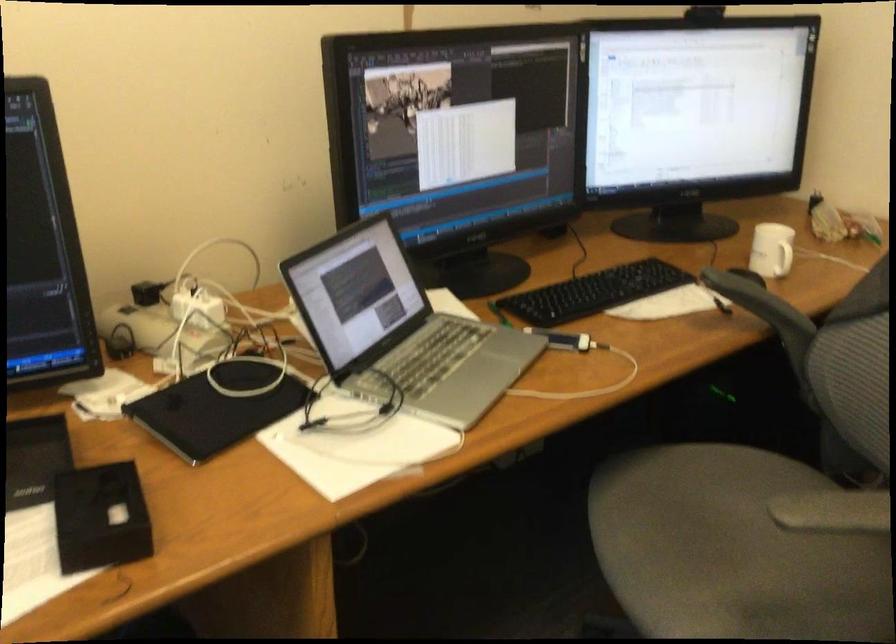
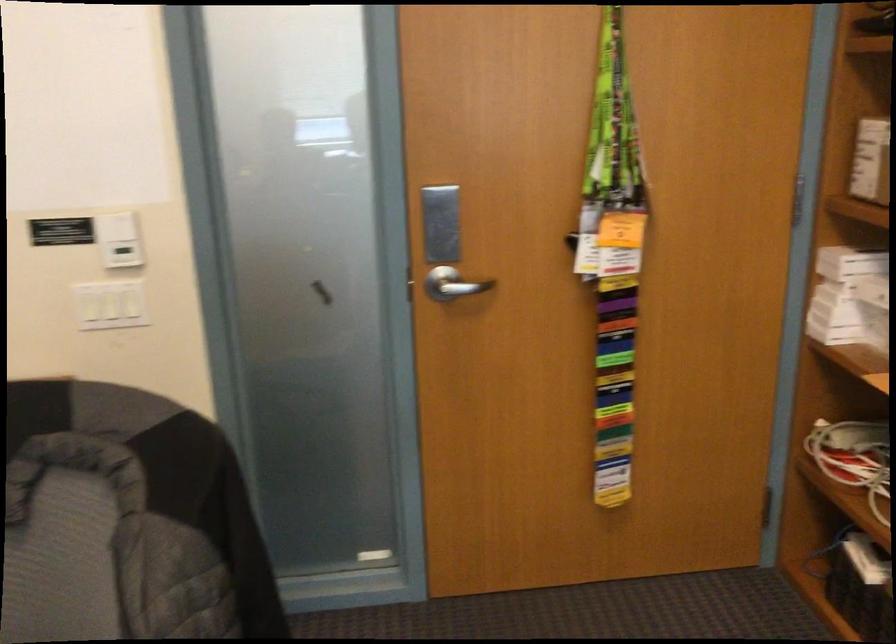
Question: The first image is from the beginning of the video and the second image is from the end. How did the camera likely rotate when shooting the video?

Choices:
 (A) Left
 (B) Right
 (C) Up
 (D) Down

Answer: (B)